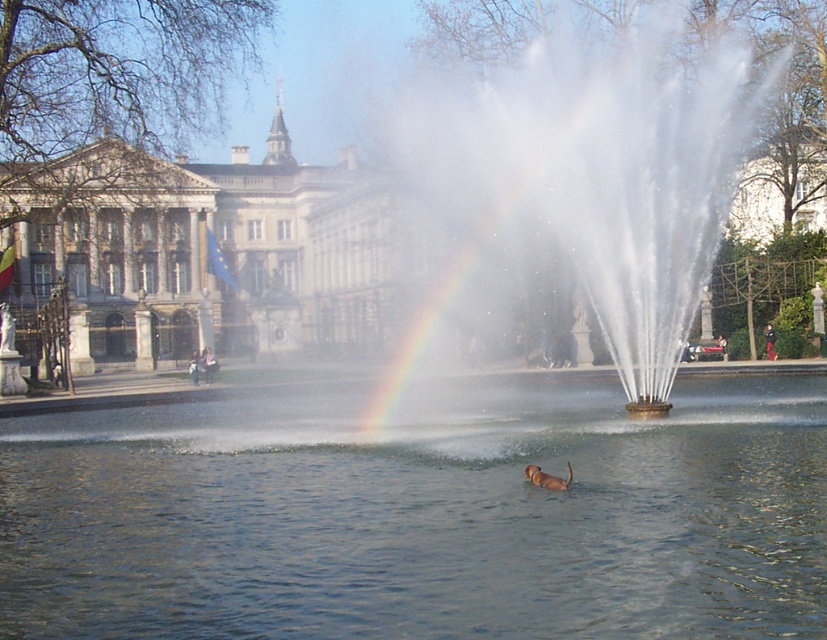
Question: Which object is farther from the camera taking this photo?

Choices:
 (A) white water at center
 (B) clear water at center
 (C) white stone building at upper left

Answer: (C)

Question: Is white water at center further to camera compared to white stone building at upper left?

Choices:
 (A) no
 (B) yes

Answer: (A)

Question: Which of the following is the farthest from the observer?

Choices:
 (A) (644, 92)
 (B) (116, 237)
 (C) (68, 522)

Answer: (B)

Question: Can you confirm if clear water at center is smaller than white stone building at upper left?

Choices:
 (A) no
 (B) yes

Answer: (B)

Question: Estimate the real-world distances between objects in this image. Which object is farther from the white stone building at upper left?

Choices:
 (A) white water at center
 (B) clear water at center

Answer: (B)

Question: Is clear water at center to the right of white water at center from the viewer's perspective?

Choices:
 (A) yes
 (B) no

Answer: (B)